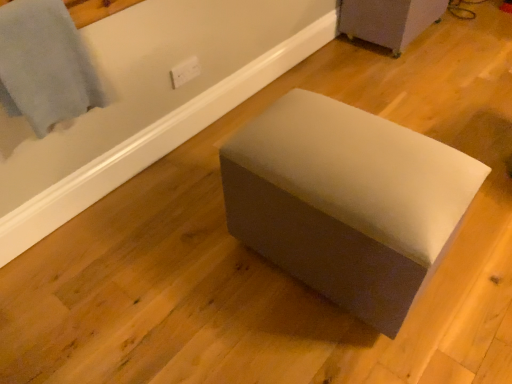
This screenshot has height=384, width=512. I want to click on suede-like gray ottoman at center, so click(x=149, y=101).

Locate an element on the screen. This screenshot has height=384, width=512. suede-like gray ottoman at center, arranged as the second furniture when viewed from the right is located at coordinates (346, 201).

In order to face matte gray ottoman at center, which ranks as the first furniture in top-to-bottom order, should I rotate leftwards or rightwards?

To align with it, rotate right about 18.469°.

This screenshot has height=384, width=512. In order to click on light blue fabric at upper left in this screenshot , I will do `click(44, 65)`.

Are suede-like gray ottoman at center and suede-like gray ottoman at center, the first furniture viewed from the front, far apart?

No, suede-like gray ottoman at center is in close proximity to suede-like gray ottoman at center, the first furniture viewed from the front.

Is the depth of suede-like gray ottoman at center greater than that of suede-like gray ottoman at center, the 1th furniture positioned from the bottom?

Yes, the depth of suede-like gray ottoman at center is greater than that of suede-like gray ottoman at center, the 1th furniture positioned from the bottom.

Who is smaller, suede-like gray ottoman at center or suede-like gray ottoman at center, which appears as the first furniture when viewed from the left?

suede-like gray ottoman at center is smaller.

Could suede-like gray ottoman at center, the 2th furniture positioned from the back, be considered to be inside suede-like gray ottoman at center?

No, suede-like gray ottoman at center, the 2th furniture positioned from the back, is located outside of suede-like gray ottoman at center.

How different are the orientations of suede-like gray ottoman at center, the first furniture viewed from the front, and matte gray ottoman at center, marked as the second furniture in a left-to-right arrangement, in degrees?

There is a 1.04-degree angle between the facing directions of suede-like gray ottoman at center, the first furniture viewed from the front, and matte gray ottoman at center, marked as the second furniture in a left-to-right arrangement.

Which object is thinner, suede-like gray ottoman at center, placed as the second furniture when sorted from top to bottom, or matte gray ottoman at center, the 2th furniture positioned from the front?

matte gray ottoman at center, the 2th furniture positioned from the front.

In the image, is suede-like gray ottoman at center, arranged as the second furniture when viewed from the right, positioned in front of or behind matte gray ottoman at center, which ranks as the first furniture in top-to-bottom order?

Clearly, suede-like gray ottoman at center, arranged as the second furniture when viewed from the right, is in front of matte gray ottoman at center, which ranks as the first furniture in top-to-bottom order.

You are a GUI agent. You are given a task and a screenshot of the screen. Output one action in this format:
    pyautogui.click(x=<x>, y=<y>)
    Task: Click on the furniture on the left of matte gray ottoman at center, the first furniture positioned from the right
    This screenshot has width=512, height=384.
    Given the screenshot: What is the action you would take?
    pyautogui.click(x=346, y=201)

Looking at this image, which object is positioned more to the left, matte gray ottoman at center, marked as the second furniture in a left-to-right arrangement, or suede-like gray ottoman at center?

suede-like gray ottoman at center.

From a real-world perspective, does matte gray ottoman at center, the 2th furniture from the bottom, sit lower than suede-like gray ottoman at center?

Incorrect, from a real-world perspective, matte gray ottoman at center, the 2th furniture from the bottom, is higher than suede-like gray ottoman at center.

Which is farther, (356,15) or (142,34)?

The point (356,15) is behind.

Can we say matte gray ottoman at center, the 2th furniture positioned from the front, lies outside suede-like gray ottoman at center?

Yes, matte gray ottoman at center, the 2th furniture positioned from the front, is located beyond the bounds of suede-like gray ottoman at center.

The height and width of the screenshot is (384, 512). In order to click on furniture above the suede-like gray ottoman at center, the 1th furniture positioned from the bottom (from the image's perspective) in this screenshot , I will do `click(389, 20)`.

Is matte gray ottoman at center, the first furniture positioned from the right, wider or thinner than suede-like gray ottoman at center, the 2th furniture positioned from the back?

Clearly, matte gray ottoman at center, the first furniture positioned from the right, has less width compared to suede-like gray ottoman at center, the 2th furniture positioned from the back.

Based on the photo, is matte gray ottoman at center, the 2th furniture from the bottom, not near suede-like gray ottoman at center, which appears as the first furniture when viewed from the left?

Yes, matte gray ottoman at center, the 2th furniture from the bottom, and suede-like gray ottoman at center, which appears as the first furniture when viewed from the left, are quite far apart.

Is suede-like gray ottoman at center, the 2th furniture positioned from the back, at the back of matte gray ottoman at center, the 2th furniture positioned from the front?

That's not correct — matte gray ottoman at center, the 2th furniture positioned from the front, is not looking away from suede-like gray ottoman at center, the 2th furniture positioned from the back.

Can you confirm if suede-like gray ottoman at center is taller than matte gray ottoman at center, which ranks as the first furniture in top-to-bottom order?

No.

Between suede-like gray ottoman at center and matte gray ottoman at center, marked as the second furniture in a left-to-right arrangement, which one has smaller width?

With smaller width is suede-like gray ottoman at center.

From a real-world perspective, which object stands above the other?

In real-world perspective, matte gray ottoman at center, marked as the second furniture in a left-to-right arrangement, is above.

Would you consider suede-like gray ottoman at center to be distant from matte gray ottoman at center, the first furniture positioned from the right?

Yes, suede-like gray ottoman at center is far from matte gray ottoman at center, the first furniture positioned from the right.

From the image's perspective, does matte gray ottoman at center, the 2th furniture positioned from the front, appear lower than light blue fabric at upper left?

No, from the image's perspective, matte gray ottoman at center, the 2th furniture positioned from the front, is not beneath light blue fabric at upper left.

Is matte gray ottoman at center, which ranks as the first furniture in top-to-bottom order, taller or shorter than light blue fabric at upper left?

Clearly, matte gray ottoman at center, which ranks as the first furniture in top-to-bottom order, is shorter compared to light blue fabric at upper left.

From a real-world perspective, relative to light blue fabric at upper left, is matte gray ottoman at center, marked as the second furniture in a left-to-right arrangement, vertically above or below?

matte gray ottoman at center, marked as the second furniture in a left-to-right arrangement, is below light blue fabric at upper left.

Looking at the image, does matte gray ottoman at center, the 2th furniture from the bottom, seem bigger or smaller compared to light blue fabric at upper left?

Clearly, matte gray ottoman at center, the 2th furniture from the bottom, is larger in size than light blue fabric at upper left.

Measure the distance from suede-like gray ottoman at center, the 2th furniture positioned from the back, to light blue fabric at upper left.

suede-like gray ottoman at center, the 2th furniture positioned from the back, and light blue fabric at upper left are 73.13 centimeters apart from each other.

Where is `bath towel that appears above the suede-like gray ottoman at center, the first furniture viewed from the front (from a real-world perspective)`? bath towel that appears above the suede-like gray ottoman at center, the first furniture viewed from the front (from a real-world perspective) is located at coordinates (44, 65).

From the image's perspective, which one is positioned higher, suede-like gray ottoman at center, the 1th furniture positioned from the bottom, or light blue fabric at upper left?

light blue fabric at upper left appears higher in the image.

Relative to light blue fabric at upper left, is suede-like gray ottoman at center, which appears as the first furniture when viewed from the left, in front or behind?

Clearly, suede-like gray ottoman at center, which appears as the first furniture when viewed from the left, is in front of light blue fabric at upper left.

The width and height of the screenshot is (512, 384). What are the coordinates of `bath that is behind the suede-like gray ottoman at center, placed as the second furniture when sorted from top to bottom` in the screenshot? It's located at (149, 101).

Find the location of `furniture on the left of matte gray ottoman at center, which is counted as the first furniture, starting from the back`. furniture on the left of matte gray ottoman at center, which is counted as the first furniture, starting from the back is located at coordinates (346, 201).

Looking at the image, which one is located further to suede-like gray ottoman at center, which appears as the first furniture when viewed from the left, matte gray ottoman at center, which is counted as the first furniture, starting from the back, or suede-like gray ottoman at center?

matte gray ottoman at center, which is counted as the first furniture, starting from the back, is positioned further to the anchor suede-like gray ottoman at center, which appears as the first furniture when viewed from the left.

When comparing their distances from light blue fabric at upper left, does suede-like gray ottoman at center, which appears as the first furniture when viewed from the left, or matte gray ottoman at center, the 2th furniture positioned from the front, seem closer?

suede-like gray ottoman at center, which appears as the first furniture when viewed from the left.

Based on their spatial positions, is light blue fabric at upper left or matte gray ottoman at center, the 2th furniture from the bottom, further from suede-like gray ottoman at center?

The object further to suede-like gray ottoman at center is matte gray ottoman at center, the 2th furniture from the bottom.

When comparing their distances from suede-like gray ottoman at center, placed as the second furniture when sorted from top to bottom, does light blue fabric at upper left or matte gray ottoman at center, which is counted as the first furniture, starting from the back, seem further?

Based on the image, matte gray ottoman at center, which is counted as the first furniture, starting from the back, appears to be further to suede-like gray ottoman at center, placed as the second furniture when sorted from top to bottom.

Looking at the image, which one is located further to light blue fabric at upper left, matte gray ottoman at center, which ranks as the first furniture in top-to-bottom order, or suede-like gray ottoman at center?

Among the two, matte gray ottoman at center, which ranks as the first furniture in top-to-bottom order, is located further to light blue fabric at upper left.

Which object lies further to the anchor point light blue fabric at upper left, suede-like gray ottoman at center or suede-like gray ottoman at center, arranged as the second furniture when viewed from the right?

suede-like gray ottoman at center, arranged as the second furniture when viewed from the right, is positioned further to the anchor light blue fabric at upper left.

Looking at the image, which one is located closer to light blue fabric at upper left, matte gray ottoman at center, which is counted as the first furniture, starting from the back, or suede-like gray ottoman at center, the first furniture viewed from the front?

suede-like gray ottoman at center, the first furniture viewed from the front, is positioned closer to the anchor light blue fabric at upper left.

Looking at the image, which one is located further to matte gray ottoman at center, marked as the second furniture in a left-to-right arrangement, suede-like gray ottoman at center or light blue fabric at upper left?

light blue fabric at upper left is positioned further to the anchor matte gray ottoman at center, marked as the second furniture in a left-to-right arrangement.

I want to click on furniture between light blue fabric at upper left and matte gray ottoman at center, the first furniture positioned from the right, so click(346, 201).

I want to click on bath located between suede-like gray ottoman at center, the 1th furniture positioned from the bottom, and matte gray ottoman at center, marked as the second furniture in a left-to-right arrangement, in the depth direction, so click(149, 101).

Where is `bath between light blue fabric at upper left and suede-like gray ottoman at center, the 2th furniture positioned from the back, from left to right`? The width and height of the screenshot is (512, 384). bath between light blue fabric at upper left and suede-like gray ottoman at center, the 2th furniture positioned from the back, from left to right is located at coordinates (149, 101).

The height and width of the screenshot is (384, 512). I want to click on bath situated between light blue fabric at upper left and matte gray ottoman at center, the 2th furniture from the bottom, from left to right, so click(x=149, y=101).